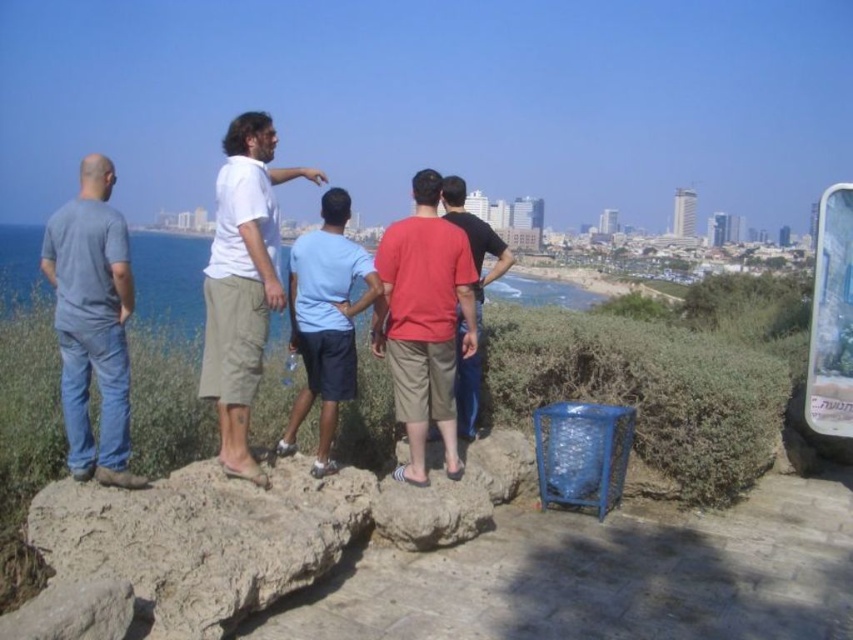
You are a photographer trying to capture a group photo of the red cotton shirt at center and the matte red shirt at center. Which one should you focus on first if you want to ensure the larger subject is in sharp focus?

The red cotton shirt at center is bigger than the matte red shirt at center, so you should focus on the red cotton shirt at center first to ensure the larger subject is in sharp focus.

You are a photographer at the rocky outcrop. You want to take a photo of the red cotton shirt at center and the matte red shirt at center. Which one is positioned lower in the frame?

The red cotton shirt at center is positioned lower than the matte red shirt at center in the frame.